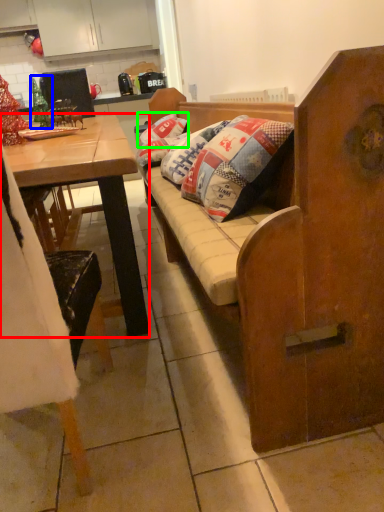
Question: Which object is the closest to the desk (highlighted by a red box)? Choose among these: christmas decoration (highlighted by a blue box) or pillow (highlighted by a green box).

Choices:
 (A) christmas decoration
 (B) pillow

Answer: (A)